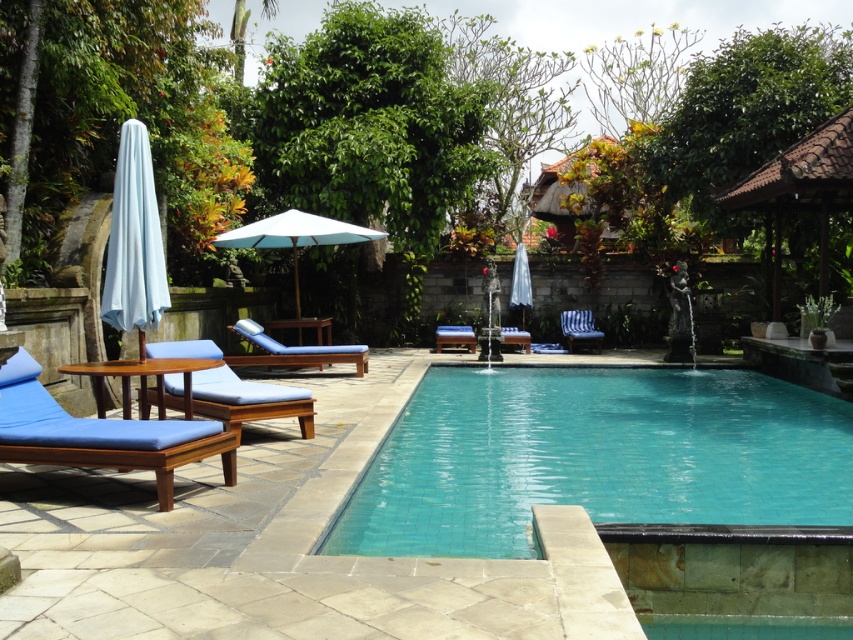
Who is taller, green leafy tree at upper left or blue fabric lounge chair at left?

green leafy tree at upper left is taller.

Looking at this image, does green leafy tree at upper left come in front of blue fabric lounge chair at left?

That is False.

You are a GUI agent. You are given a task and a screenshot of the screen. Output one action in this format:
    pyautogui.click(x=<x>, y=<y>)
    Task: Click on the green leafy tree at upper left
    The height and width of the screenshot is (640, 853).
    Given the screenshot: What is the action you would take?
    pyautogui.click(x=109, y=113)

In the scene shown: Is green leafy tree at upper center further to the viewer compared to white wood umbrella at center?

Yes.

Who is higher up, green leafy tree at upper center or white wood umbrella at center?

Positioned higher is green leafy tree at upper center.

Identify the location of green leafy tree at upper center. (369, 125).

Is blue fabric chair at lower left above blue fabric lounge chair at center?

Incorrect, blue fabric chair at lower left is not positioned above blue fabric lounge chair at center.

How far apart are blue fabric chair at lower left and blue fabric lounge chair at center?

blue fabric chair at lower left is 30.09 feet from blue fabric lounge chair at center.

Where is `blue fabric chair at lower left`? blue fabric chair at lower left is located at coordinates (99, 433).

Identify the location of blue fabric chair at lower left. This screenshot has height=640, width=853. (99, 433).